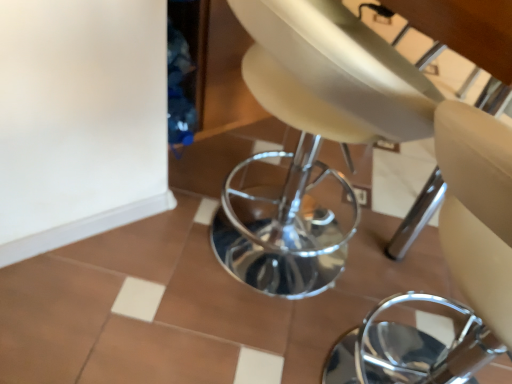
I want to click on blank space to the left of beige leather swivel chair at center, so click(x=120, y=265).